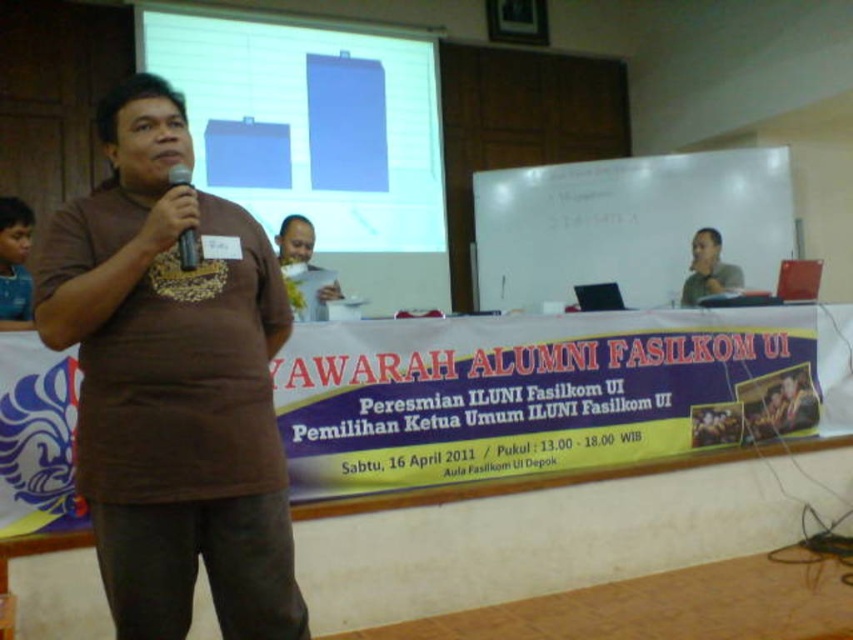
Question: Which object is farther from the camera taking this photo?

Choices:
 (A) matte blue projector screen at upper center
 (B) brown cotton shirt at center

Answer: (A)

Question: Which object is positioned farthest from the gray fabric shirt at upper center?

Choices:
 (A) matte blue projector screen at upper center
 (B) brown matte paper at center
 (C) black matte microphone at left
 (D) brown cotton shirt at center

Answer: (C)

Question: Is matte blue projector screen at upper center below brown matte paper at center?

Choices:
 (A) yes
 (B) no

Answer: (B)

Question: Is matte blue projector screen at upper center further to the viewer compared to brown matte paper at center?

Choices:
 (A) yes
 (B) no

Answer: (A)

Question: Is brown cotton shirt at center to the left of brown matte paper at center from the viewer's perspective?

Choices:
 (A) no
 (B) yes

Answer: (B)

Question: Considering the real-world distances, which object is closest to the brown matte paper at center?

Choices:
 (A) matte blue projector screen at upper center
 (B) brown cotton shirt at center
 (C) gray fabric shirt at upper center
 (D) black matte microphone at left

Answer: (B)